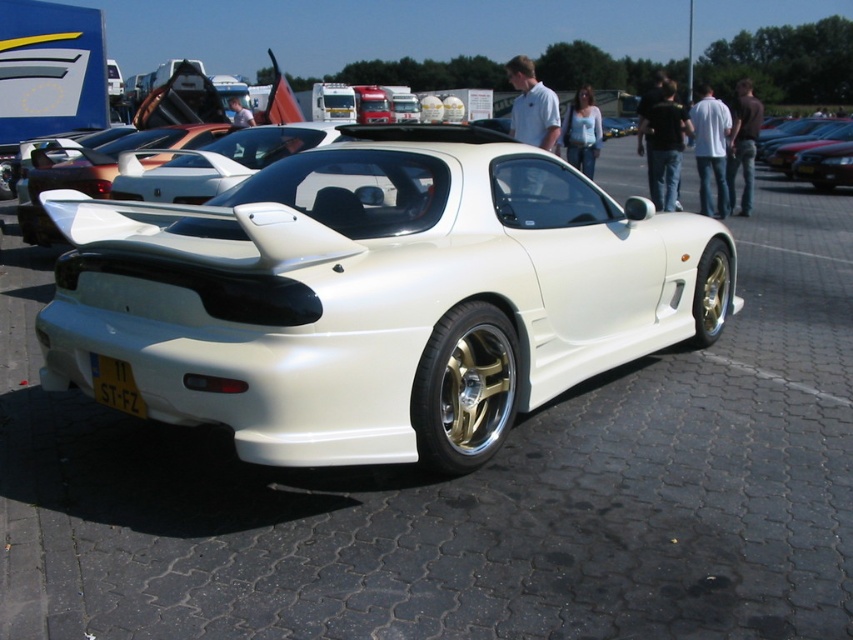
Question: Is yellow matte license plate at lower center bigger than white metallic car at center?

Choices:
 (A) yes
 (B) no

Answer: (B)

Question: Is yellow matte license plate at lower center wider than white metallic car at center?

Choices:
 (A) yes
 (B) no

Answer: (B)

Question: Which point is closer to the camera?

Choices:
 (A) yellow matte license plate at lower center
 (B) white metallic car at center

Answer: (A)

Question: In this image, where is yellow matte license plate at lower center located relative to white metallic car at center?

Choices:
 (A) above
 (B) below

Answer: (B)